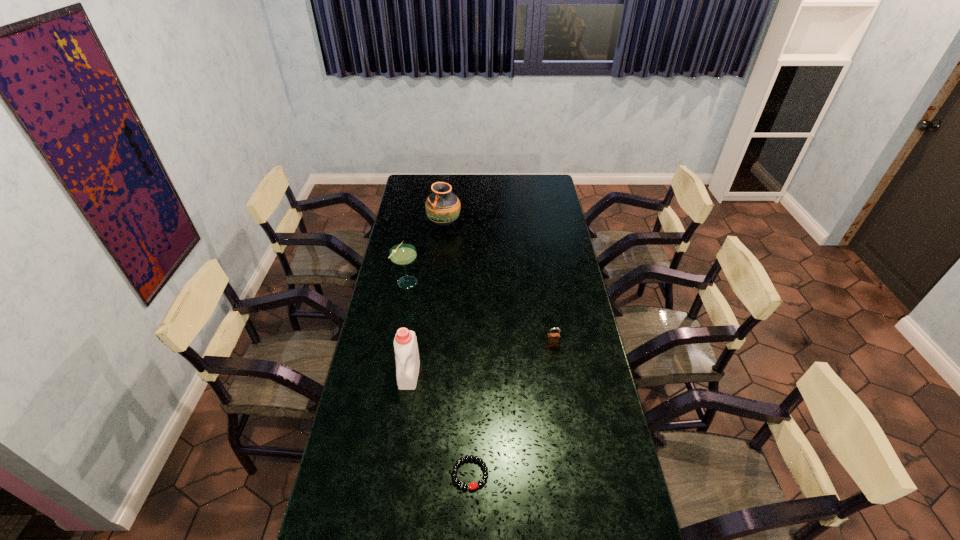
Where is `free space at the far left corner`? This screenshot has height=540, width=960. free space at the far left corner is located at coordinates (422, 183).

Identify the location of empty space between the nearest object and the third tallest object. The width and height of the screenshot is (960, 540). (439, 377).

The width and height of the screenshot is (960, 540). Identify the location of vacant space in between the shortest object and the third tallest object. (439, 377).

Locate an element on the screen. vacant space in between the rightmost object and the third shortest object is located at coordinates (480, 313).

Locate an element on the screen. This screenshot has height=540, width=960. vacant area between the detergent and the rightmost object is located at coordinates (481, 359).

At what (x,y) coordinates should I click in order to perform the action: click on empty location between the fourth object from left to right and the martini. Please return your answer as a coordinate pair (x, y). The width and height of the screenshot is (960, 540). Looking at the image, I should click on (439, 377).

I want to click on free spot between the second object from right to left and the farthest object, so (x=457, y=348).

In order to click on vacant area that lies between the farthest object and the bracelet in this screenshot , I will do `click(457, 348)`.

This screenshot has height=540, width=960. I want to click on free space between the pottery and the shortest object, so click(457, 348).

You are a GUI agent. You are given a task and a screenshot of the screen. Output one action in this format:
    pyautogui.click(x=<x>, y=<y>)
    Task: Click on the free space between the fourth nearest object and the second nearest object
    The width and height of the screenshot is (960, 540).
    Given the screenshot: What is the action you would take?
    pyautogui.click(x=408, y=327)